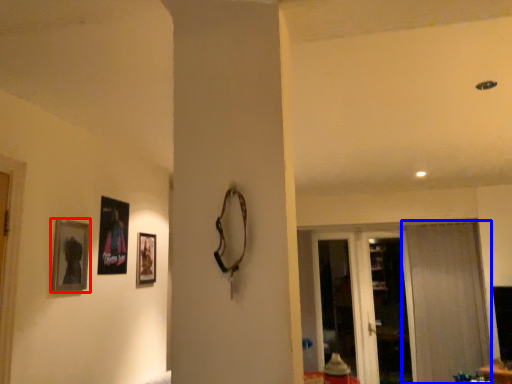
Question: Which object appears farthest to the camera in this image, picture frame (highlighted by a red box) or curtain (highlighted by a blue box)?

Choices:
 (A) picture frame
 (B) curtain

Answer: (B)